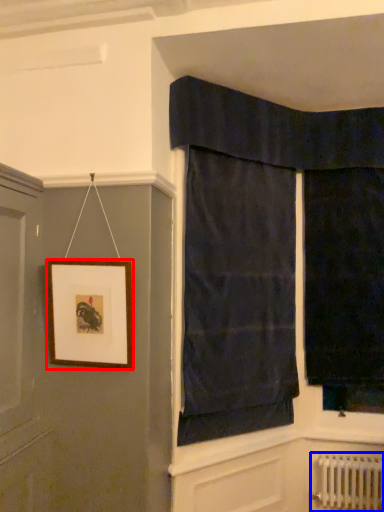
Question: Which point is further to the camera, picture frame (highlighted by a red box) or radiator (highlighted by a blue box)?

Choices:
 (A) picture frame
 (B) radiator

Answer: (B)